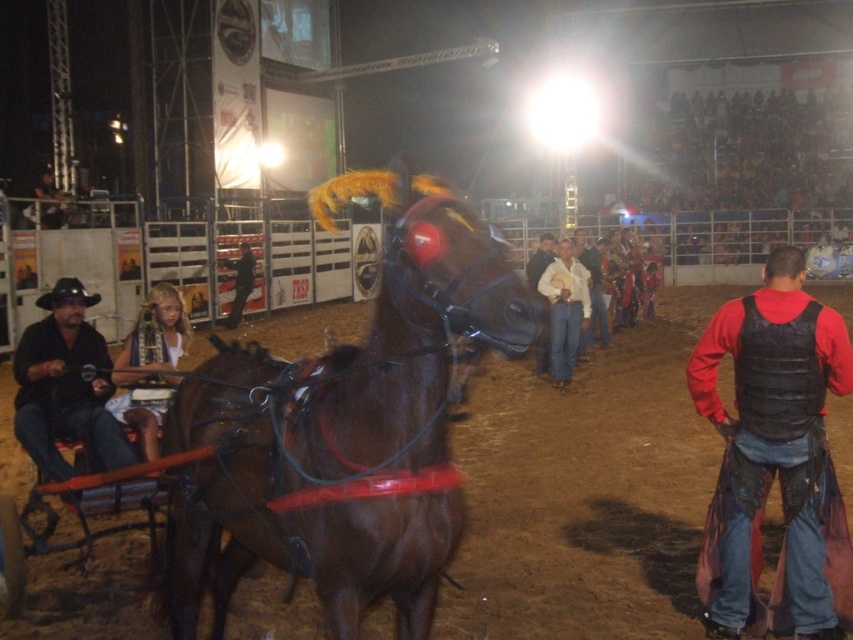
You are a photographer at the rodeo event. You want to take a photo of the red leather vest at right and the white fabric headband at left. Which object should you focus on first if you want to capture both in the same frame without moving the camera?

You should focus on the white fabric headband at left first because the red leather vest at right is positioned to its right side, so keeping the headband centered will allow the vest to be included in the frame as well.

Looking at this image, you are a photographer at the rodeo event. You want to capture a photo where both the brown glossy horse at center and the red leather vest at right are clearly visible. Based on their sizes in the image, which object should you focus on first to ensure proper framing?

The brown glossy horse at center is smaller than the red leather vest at right, so you should focus on the red leather vest at right first to ensure proper framing since it takes up more space in the image.

You are a photographer at the rodeo event. You need to capture a photo where both the red leather vest at right and the white fabric headband at left are visible. Given their widths, which object should you ensure is closer to the center of the frame to avoid being cut off?

The red leather vest at right has a lesser width compared to the white fabric headband at left, so you should position the red leather vest at right closer to the center of the frame to ensure it fits within the photo without being cut off.